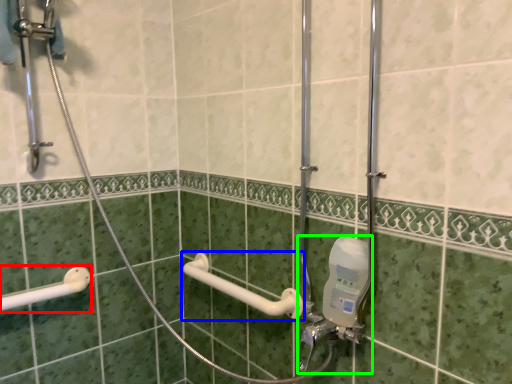
Question: Estimate the real-world distances between objects in this image. Which object is closer to shower (highlighted by a red box), towel bar (highlighted by a blue box) or plumbing fixture (highlighted by a green box)?

Choices:
 (A) towel bar
 (B) plumbing fixture

Answer: (A)